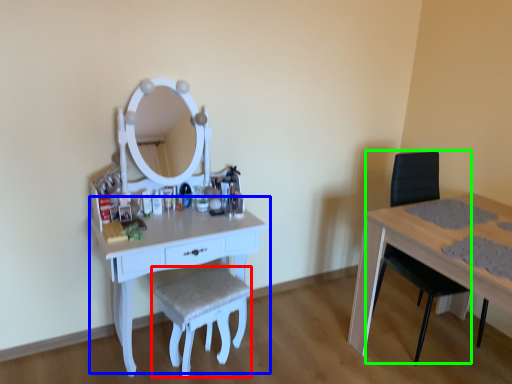
Question: Based on their relative distances, which object is nearer to stool (highlighted by a red box)? Choose from table (highlighted by a blue box) and swivel chair (highlighted by a green box).

Choices:
 (A) table
 (B) swivel chair

Answer: (A)